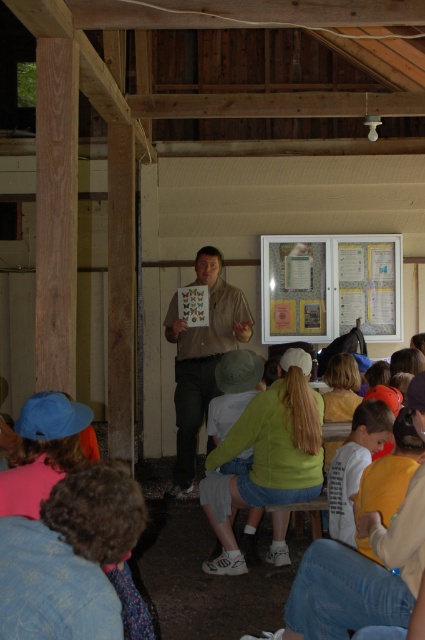
You are a teacher standing in front of the classroom. You want to hand out a handout to the student wearing the matte khaki shirt at center. The handout is on the matte yellow paper at center. Can you reach the student without moving from your current position?

The matte yellow paper at center and matte khaki shirt at center are 1.35 meters apart from each other. Since the distance is 1.35 meters, you can likely reach the student wearing the matte khaki shirt at center from the matte yellow paper at center without needing to move closer, assuming typical arm reach.

You are a photographer standing behind the children. You want to take a photo that includes both the matte khaki shirt at center and the white cotton shirt at lower right. Given that your camera has a maximum focus range of 6 feet, will both shirts be in focus?

The distance between the matte khaki shirt at center and the white cotton shirt at lower right is 6.53 feet, which exceeds the camera maximum focus range of 6 feet. Thus, both shirts cannot be in focus simultaneously.